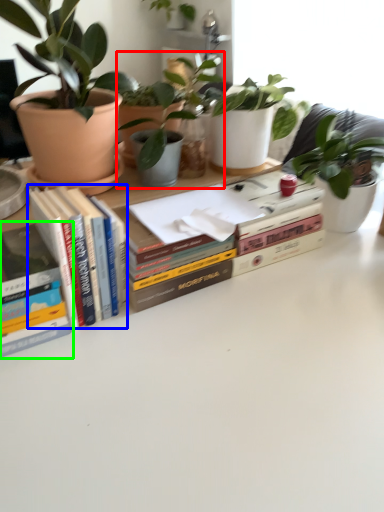
Question: Which object is positioned closest to houseplant (highlighted by a red box)? Select from book (highlighted by a blue box) and book (highlighted by a green box).

Choices:
 (A) book
 (B) book

Answer: (A)